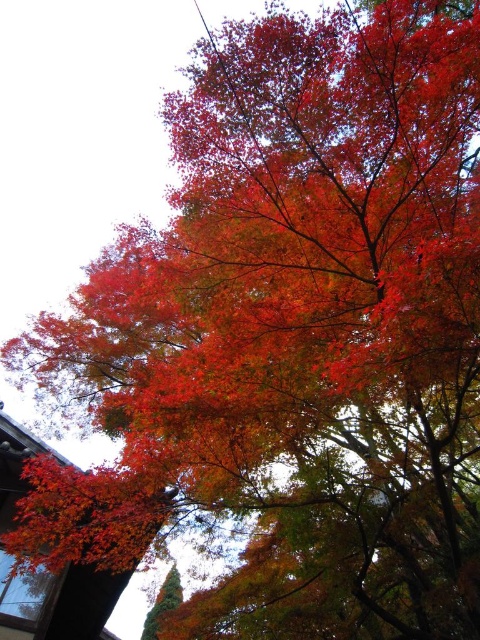
Does shiny red maple leaf at lower left have a greater width compared to shiny green pine tree at lower left?

Correct, the width of shiny red maple leaf at lower left exceeds that of shiny green pine tree at lower left.

Does point (166, 509) come closer to viewer compared to point (160, 586)?

Yes, it is.

Which is in front, point (80, 484) or point (159, 616)?

Positioned in front is point (80, 484).

The image size is (480, 640). I want to click on shiny red maple leaf at lower left, so click(84, 516).